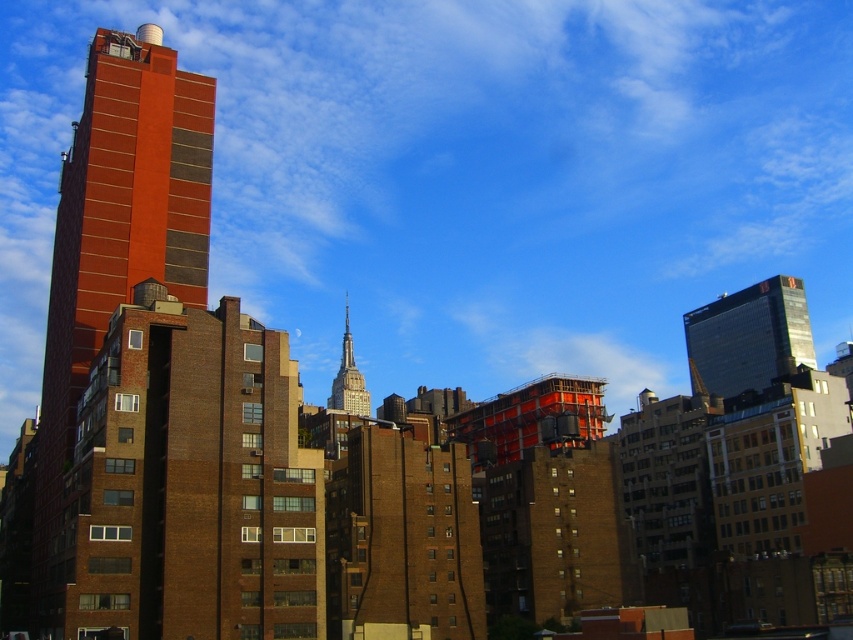
Is shiny glass skyscraper at upper right further to camera compared to white glass spire at center?

No, it is in front of white glass spire at center.

Who is more distant from viewer, [700,332] or [347,316]?

Positioned behind is point [347,316].

Between point (753, 340) and point (335, 392), which one is positioned behind?

The point (335, 392) is more distant.

Find the location of `shiny glass skyscraper at upper right`. shiny glass skyscraper at upper right is located at coordinates (747, 337).

Does brick building at left appear on the left side of white glass spire at center?

Incorrect, brick building at left is not on the left side of white glass spire at center.

Can you confirm if brick building at left is thinner than white glass spire at center?

Incorrect, brick building at left's width is not less than white glass spire at center's.

The width and height of the screenshot is (853, 640). Describe the element at coordinates (114, 256) in the screenshot. I see `brick building at left` at that location.

At what (x,y) coordinates should I click in order to perform the action: click on brick building at left. Please return your answer as a coordinate pair (x, y). Image resolution: width=853 pixels, height=640 pixels. Looking at the image, I should click on (114, 256).

Is brick building at left taller than shiny glass skyscraper at upper right?

Yes, brick building at left is taller than shiny glass skyscraper at upper right.

Which is below, brick building at left or shiny glass skyscraper at upper right?

shiny glass skyscraper at upper right

Where is `brick building at left`? brick building at left is located at coordinates (114, 256).